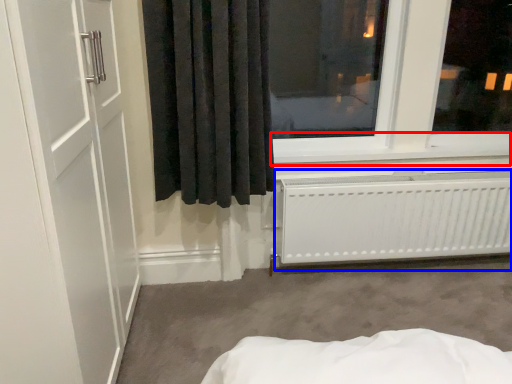
Question: Which of the following is the farthest to the observer, window sill (highlighted by a red box) or radiator (highlighted by a blue box)?

Choices:
 (A) window sill
 (B) radiator

Answer: (A)